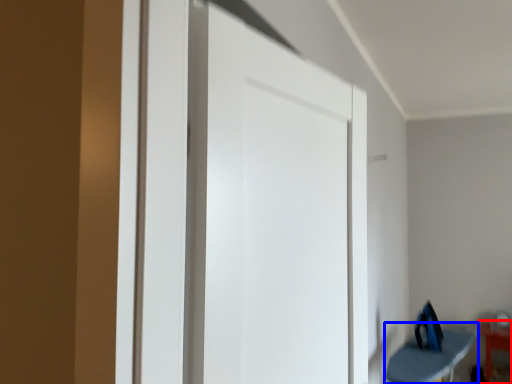
Question: Which object is further to the camera taking this photo, furniture (highlighted by a red box) or furniture (highlighted by a blue box)?

Choices:
 (A) furniture
 (B) furniture

Answer: (A)